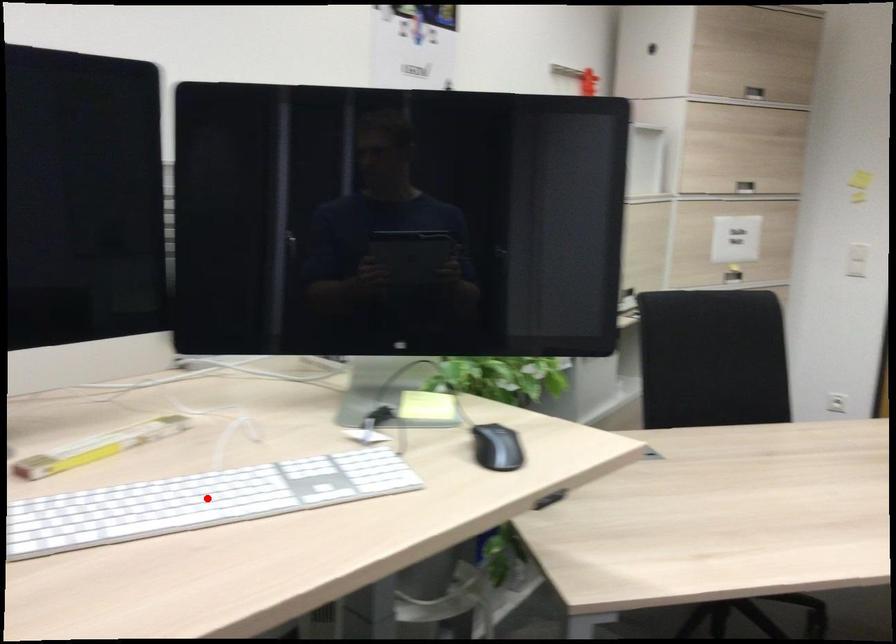
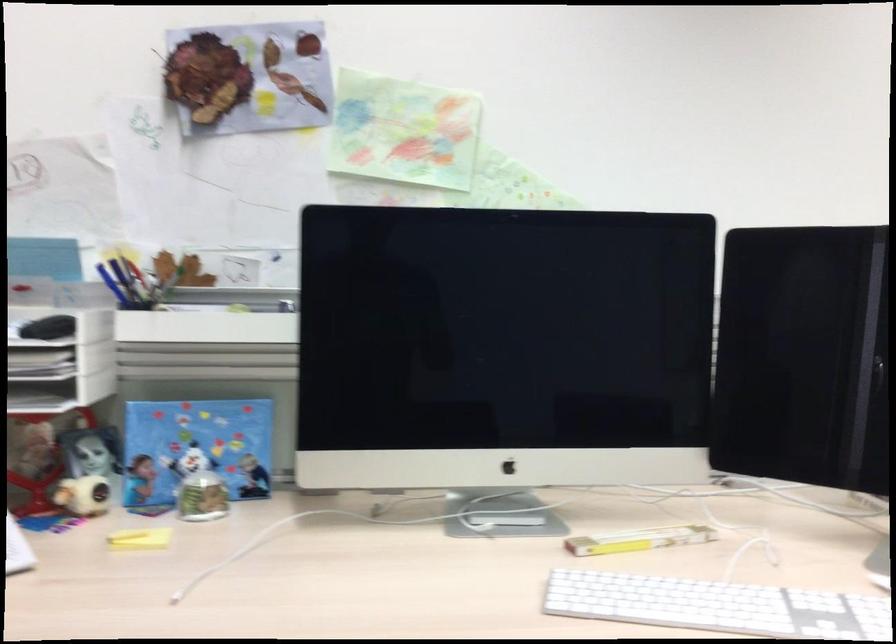
Find the pixel in the second image that matches the highlighted location in the first image.

(717, 605)